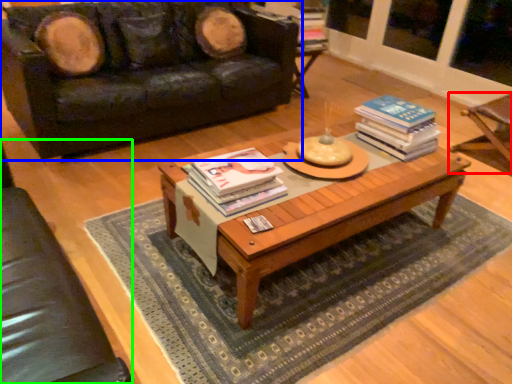
Question: Which object is the farthest from armchair (highlighted by a red box)? Choose among these: studio couch (highlighted by a blue box) or armchair (highlighted by a green box).

Choices:
 (A) studio couch
 (B) armchair

Answer: (B)